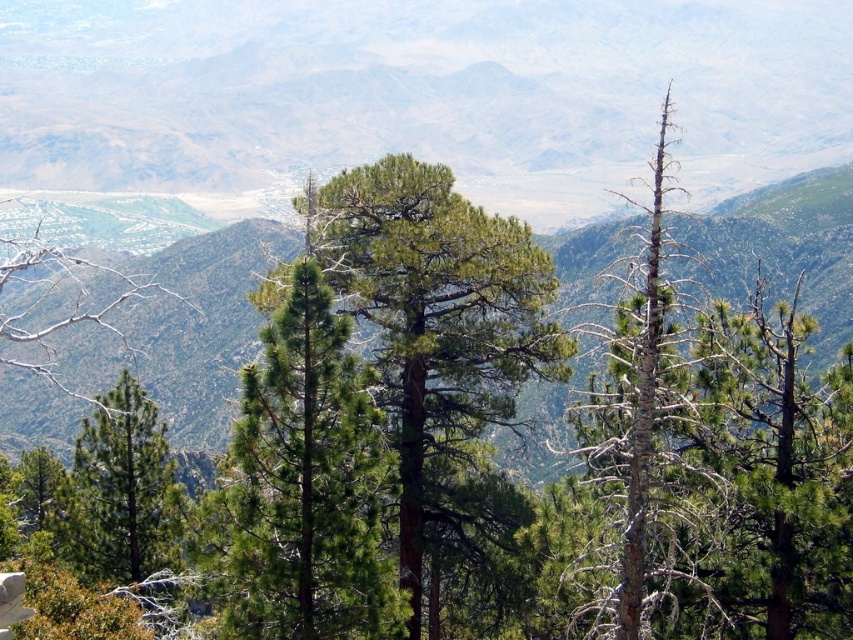
Measure the distance between green rough bark tree at center and green matte tree at left.

green rough bark tree at center and green matte tree at left are 26.32 feet apart.

Does green rough bark tree at center have a greater width compared to green matte tree at left?

Yes.

Is point (500, 300) farther from viewer compared to point (126, 484)?

That is False.

Identify the location of green rough bark tree at center. (440, 340).

Between green rough bark tree at center and green needle-like at center, which one has more height?

With more height is green rough bark tree at center.

Which is behind, point (512, 490) or point (367, 573)?

Positioned behind is point (512, 490).

Where is `green rough bark tree at center`? This screenshot has width=853, height=640. green rough bark tree at center is located at coordinates (440, 340).

Who is taller, green needle-like at center or green needle-like at right?

green needle-like at right is taller.

Based on the photo, is green needle-like at center taller than green needle-like at right?

In fact, green needle-like at center may be shorter than green needle-like at right.

Is point (274, 620) in front of point (701, 342)?

Yes, point (274, 620) is closer to viewer.

Identify the location of green needle-like at center. The width and height of the screenshot is (853, 640). (300, 488).